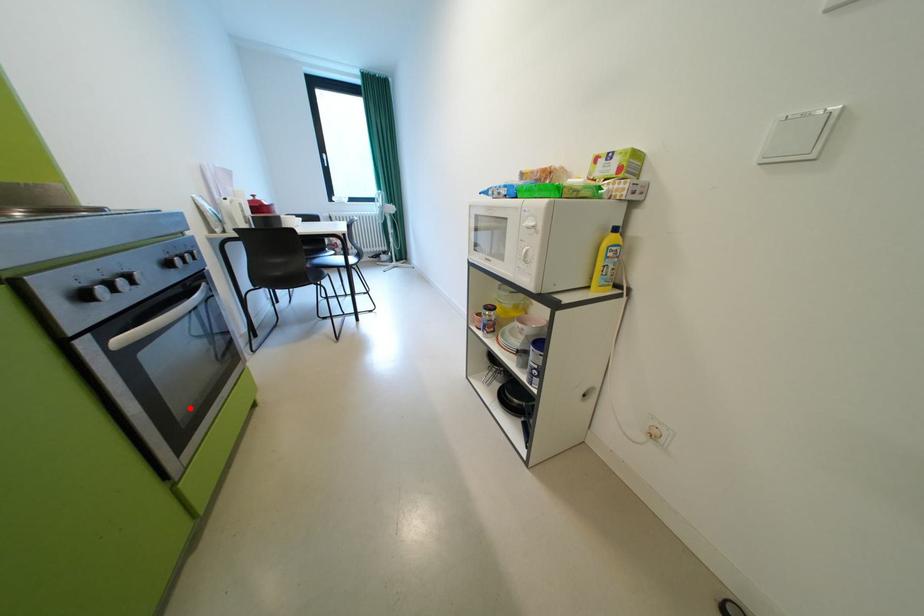
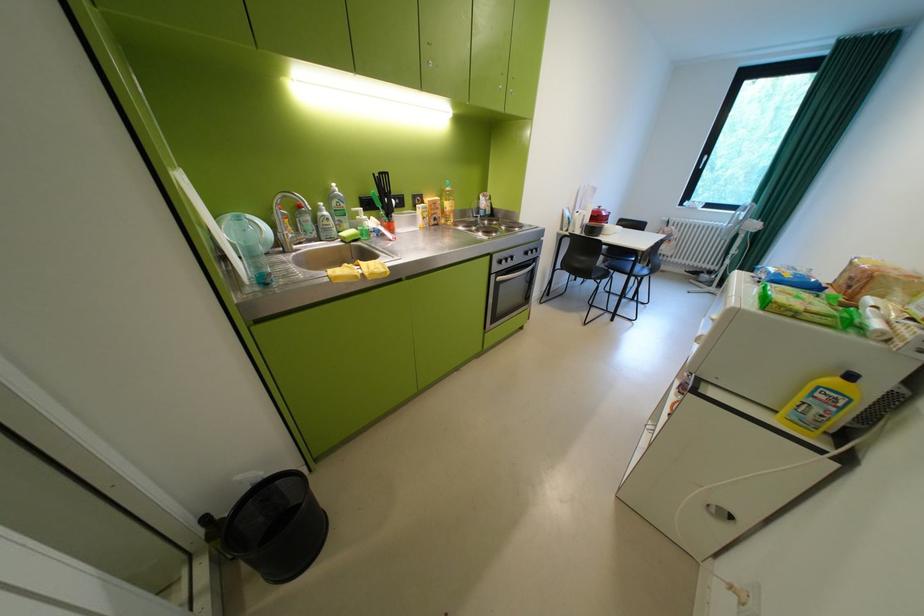
Find the pixel in the second image that matches the highlighted location in the first image.

(511, 310)